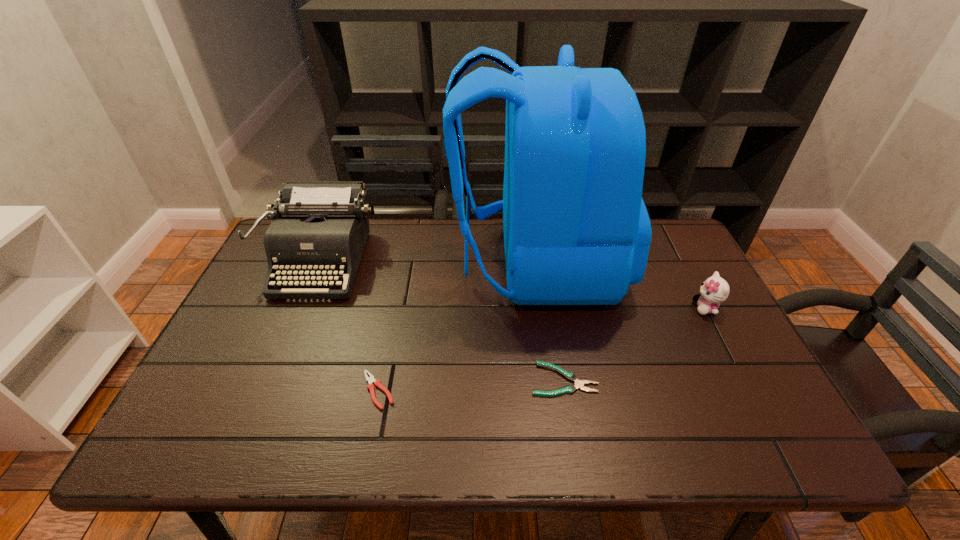
I want to click on vacant area situated 0.270m on the front-facing side of the leftmost object, so click(269, 384).

Find the location of a particular element. This screenshot has width=960, height=540. vacant space located on the front-facing side of the third tallest object is located at coordinates (569, 308).

Locate an element on the screen. This screenshot has width=960, height=540. vacant space located 0.220m on the front-facing side of the third tallest object is located at coordinates (612, 308).

Where is `free location located 0.170m on the front-facing side of the third tallest object`? free location located 0.170m on the front-facing side of the third tallest object is located at coordinates (631, 308).

This screenshot has width=960, height=540. Identify the location of vacant area located on the left of the second object from left to right. (x=247, y=390).

Locate an element on the screen. The width and height of the screenshot is (960, 540). vacant region located on the right of the right pliers is located at coordinates (751, 380).

Image resolution: width=960 pixels, height=540 pixels. Identify the location of backpack that is positioned at the far edge. (576, 230).

Find the location of `typewriter positioned at the far edge`. typewriter positioned at the far edge is located at coordinates (319, 229).

Find the location of a particular element. The width and height of the screenshot is (960, 540). object that is at the left edge is located at coordinates (319, 229).

You are a GUI agent. You are given a task and a screenshot of the screen. Output one action in this format:
    pyautogui.click(x=<x>, y=<y>)
    Task: Click on the object at the right edge
    This screenshot has height=540, width=960.
    Given the screenshot: What is the action you would take?
    pyautogui.click(x=714, y=290)